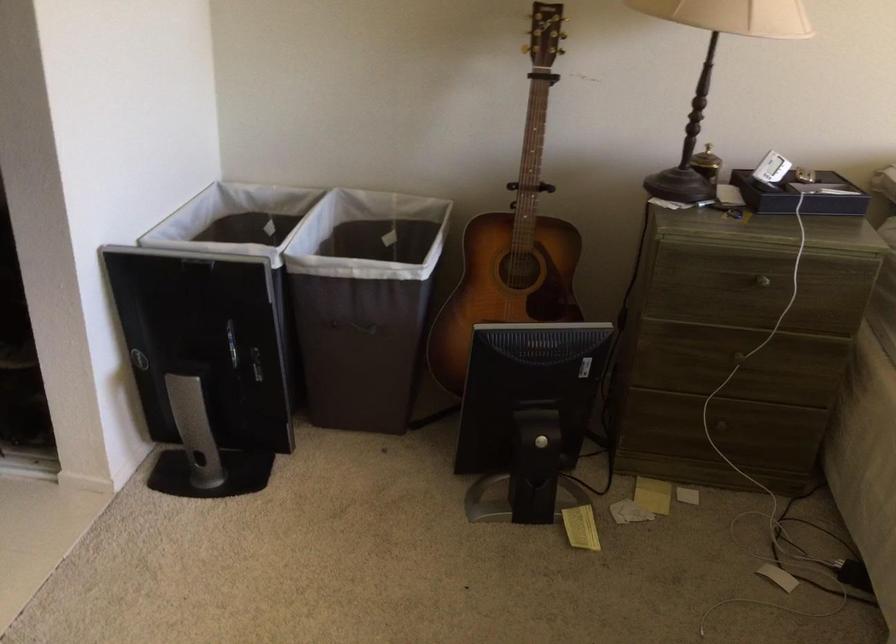
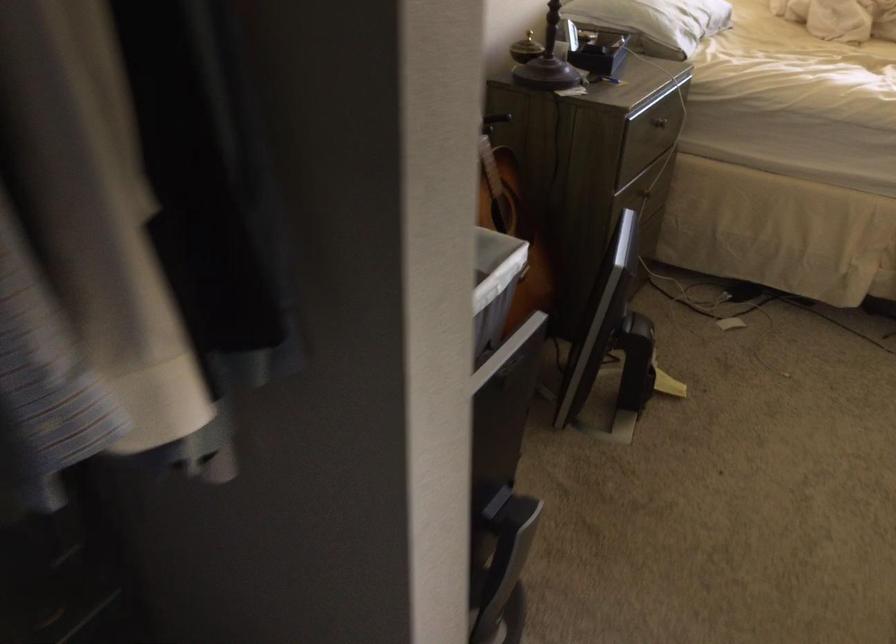
Find the pixel in the second image that matches pixel 547 289 in the first image.

(513, 227)